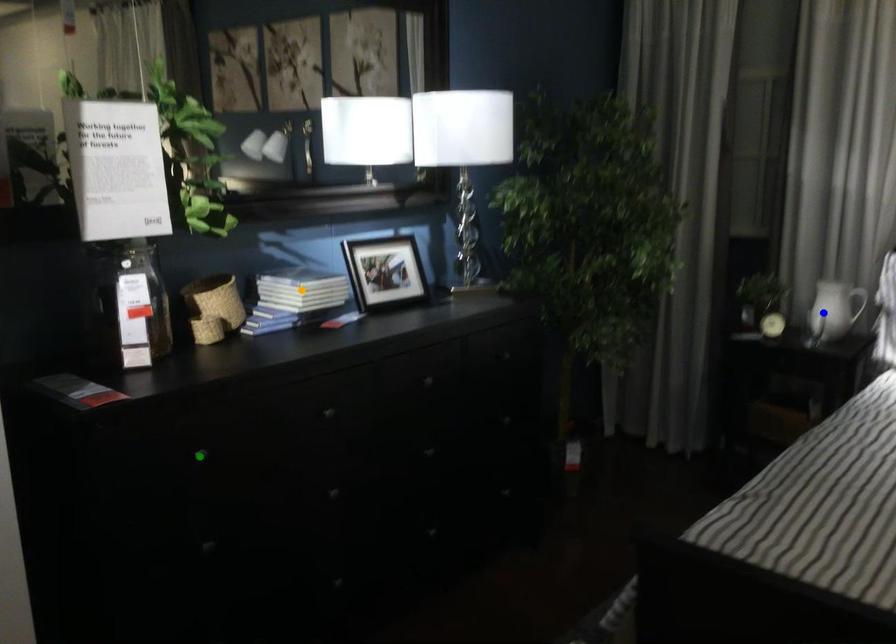
Order these from nearest to farthest:
- orange point
- blue point
- green point

blue point
orange point
green point